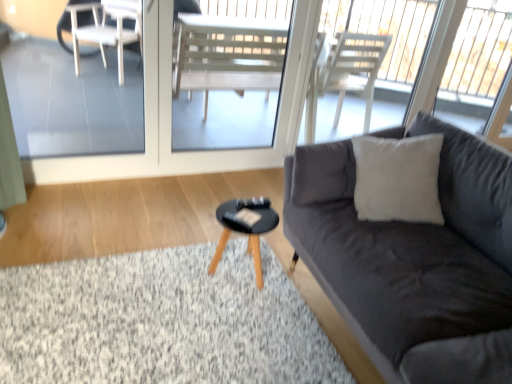
Question: Is soft gray carpet at lower left with dark gray fabric couch at right?

Choices:
 (A) yes
 (B) no

Answer: (B)

Question: Is there a large distance between soft gray carpet at lower left and dark gray fabric couch at right?

Choices:
 (A) no
 (B) yes

Answer: (A)

Question: Does soft gray carpet at lower left have a lesser height compared to dark gray fabric couch at right?

Choices:
 (A) no
 (B) yes

Answer: (B)

Question: From the image's perspective, does soft gray carpet at lower left appear higher than dark gray fabric couch at right?

Choices:
 (A) no
 (B) yes

Answer: (A)

Question: Is the depth of soft gray carpet at lower left less than that of dark gray fabric couch at right?

Choices:
 (A) yes
 (B) no

Answer: (B)

Question: Does soft gray carpet at lower left have a greater height compared to dark gray fabric couch at right?

Choices:
 (A) no
 (B) yes

Answer: (A)

Question: Considering the relative sizes of transparent glass screen door at upper center and black wooden coffee table at center in the image provided, is transparent glass screen door at upper center bigger than black wooden coffee table at center?

Choices:
 (A) no
 (B) yes

Answer: (B)

Question: Is transparent glass screen door at upper center further to camera compared to black wooden coffee table at center?

Choices:
 (A) yes
 (B) no

Answer: (A)

Question: Does transparent glass screen door at upper center have a greater width compared to black wooden coffee table at center?

Choices:
 (A) no
 (B) yes

Answer: (A)

Question: Is transparent glass screen door at upper center not inside black wooden coffee table at center?

Choices:
 (A) no
 (B) yes

Answer: (B)

Question: Is transparent glass screen door at upper center in front of black wooden coffee table at center?

Choices:
 (A) yes
 (B) no

Answer: (B)

Question: Is transparent glass screen door at upper center aimed at black wooden coffee table at center?

Choices:
 (A) no
 (B) yes

Answer: (B)

Question: Is transparent glass screen door at upper center at the back of dark gray fabric couch at right?

Choices:
 (A) yes
 (B) no

Answer: (B)